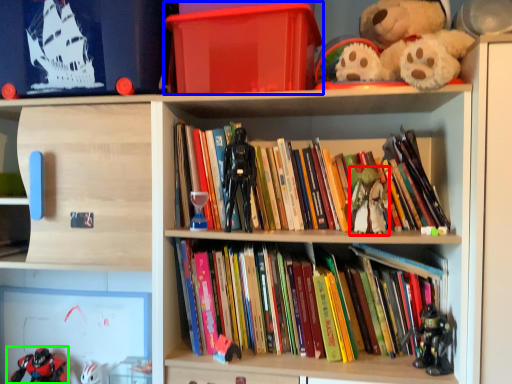
Question: Which object is the closest to the toy (highlighted by a red box)? Choose among these: box (highlighted by a blue box) or toy (highlighted by a green box).

Choices:
 (A) box
 (B) toy

Answer: (A)